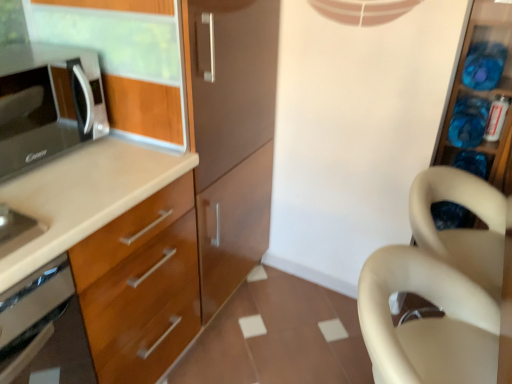
Question: Can matte black microwave at left be found inside translucent plastic containers at right?

Choices:
 (A) no
 (B) yes

Answer: (A)

Question: From the image's perspective, would you say translucent plastic containers at right is shown under matte black microwave at left?

Choices:
 (A) yes
 (B) no

Answer: (A)

Question: From a real-world perspective, is translucent plastic containers at right under matte black microwave at left?

Choices:
 (A) no
 (B) yes

Answer: (B)

Question: Is translucent plastic containers at right bigger than matte black microwave at left?

Choices:
 (A) no
 (B) yes

Answer: (B)

Question: Does translucent plastic containers at right have a smaller size compared to matte black microwave at left?

Choices:
 (A) yes
 (B) no

Answer: (B)

Question: In terms of width, does satin silver oven at lower left look wider or thinner when compared to beige matte chair at right?

Choices:
 (A) thin
 (B) wide

Answer: (B)

Question: In the image, is satin silver oven at lower left on the left side or the right side of beige matte chair at right?

Choices:
 (A) right
 (B) left

Answer: (B)

Question: Is satin silver oven at lower left situated inside beige matte chair at right or outside?

Choices:
 (A) inside
 (B) outside

Answer: (B)

Question: Relative to beige matte chair at right, is satin silver oven at lower left in front or behind?

Choices:
 (A) front
 (B) behind

Answer: (A)

Question: From a real-world perspective, is beige matte chair at right positioned above or below matte black microwave at left?

Choices:
 (A) below
 (B) above

Answer: (A)

Question: From the image's perspective, is beige matte chair at right located above or below matte black microwave at left?

Choices:
 (A) above
 (B) below

Answer: (B)

Question: Considering the positions of point pyautogui.click(x=460, y=246) and point pyautogui.click(x=91, y=109), is point pyautogui.click(x=460, y=246) closer or farther from the camera than point pyautogui.click(x=91, y=109)?

Choices:
 (A) farther
 (B) closer

Answer: (A)

Question: Is beige matte chair at right situated inside matte black microwave at left or outside?

Choices:
 (A) outside
 (B) inside

Answer: (A)

Question: Looking at the image, does beige plastic swivel chair at right seem bigger or smaller compared to translucent plastic containers at right?

Choices:
 (A) small
 (B) big

Answer: (B)

Question: From a real-world perspective, is beige plastic swivel chair at right above or below translucent plastic containers at right?

Choices:
 (A) below
 (B) above

Answer: (A)